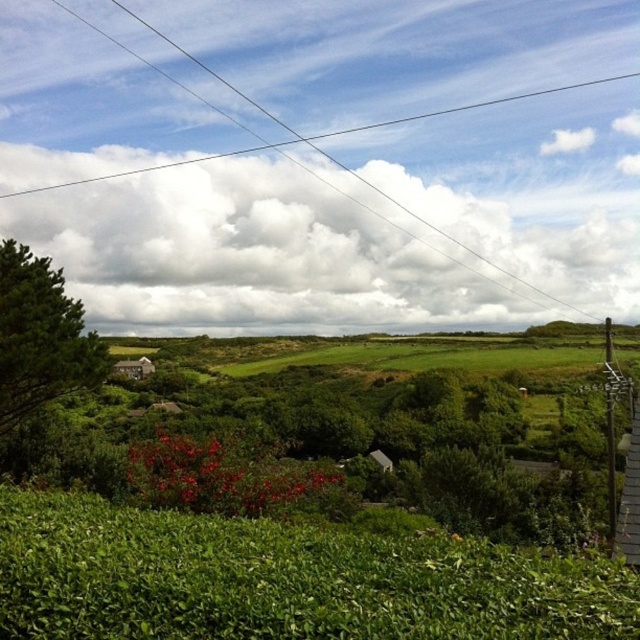
Can you confirm if clear wire at upper center is wider than green leafy tree at left?

Yes.

Does point (118, 150) lie in front of point (12, 250)?

No, it is behind (12, 250).

Locate an element on the screen. The image size is (640, 640). clear wire at upper center is located at coordinates (326, 161).